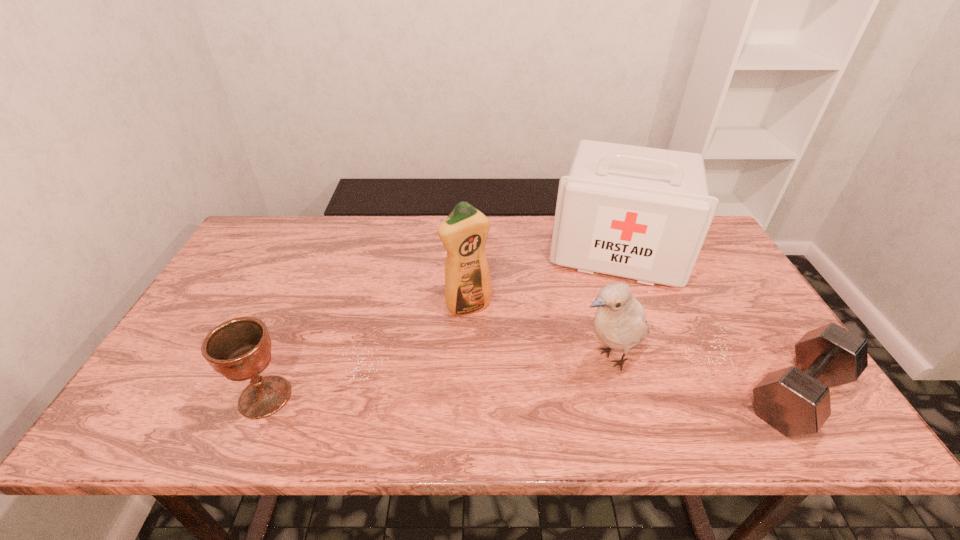
Identify the location of vacant space on the desktop that is between the fourth tallest object and the shortest object and is positioned at the beak of the third shortest object. This screenshot has height=540, width=960. (541, 395).

The height and width of the screenshot is (540, 960). Find the location of `free space on the desktop that is between the leftmost object and the dumbbell and is positioned on the label of the second farthest object`. free space on the desktop that is between the leftmost object and the dumbbell and is positioned on the label of the second farthest object is located at coordinates (525, 395).

Locate an element on the screen. vacant space on the desktop that is between the fourth tallest object and the shortest object and is positioned on the front-facing side of the first-aid kit is located at coordinates (599, 395).